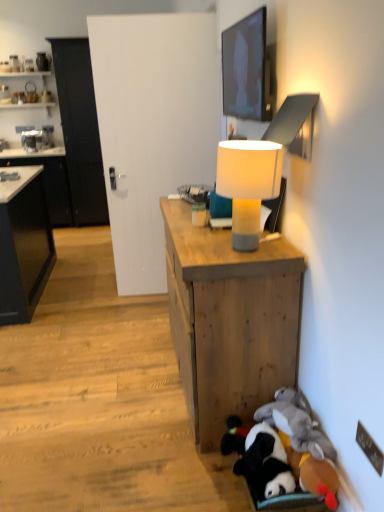
Where is `free space to the back side of white fabric lampshade at center`? Image resolution: width=384 pixels, height=512 pixels. free space to the back side of white fabric lampshade at center is located at coordinates (212, 232).